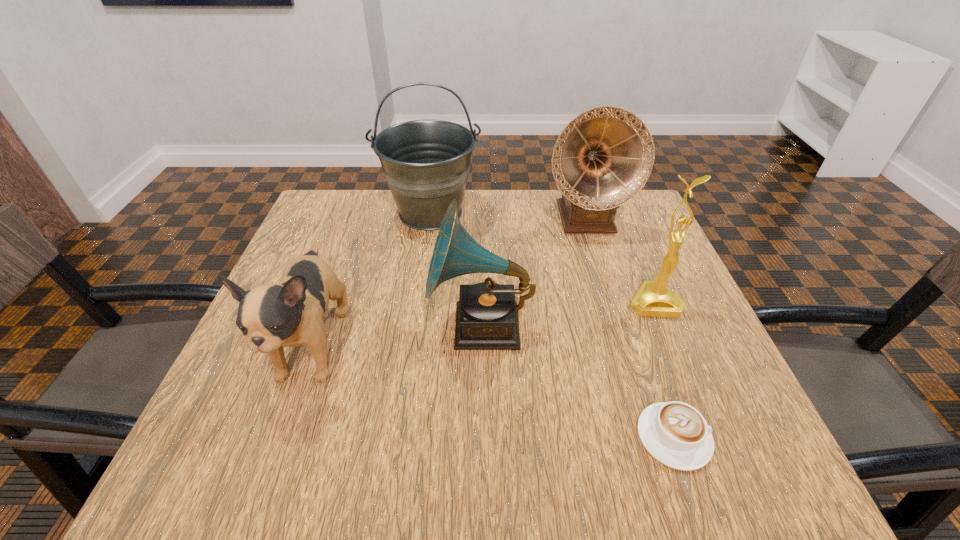
This screenshot has width=960, height=540. Find the location of `bucket`. bucket is located at coordinates (426, 163).

The image size is (960, 540). Find the location of `the farther phonograph_record`. the farther phonograph_record is located at coordinates (603, 157).

You are a GUI agent. You are given a task and a screenshot of the screen. Output one action in this format:
    pyautogui.click(x=<x>, y=<y>)
    Task: Click on the award
    This screenshot has height=540, width=960.
    Given the screenshot: What is the action you would take?
    (653, 299)

Where is `the nearer phonograph_record`? This screenshot has height=540, width=960. the nearer phonograph_record is located at coordinates (486, 314).

Where is `puppy`? Image resolution: width=960 pixels, height=540 pixels. puppy is located at coordinates (272, 316).

The width and height of the screenshot is (960, 540). I want to click on the shortest object, so (676, 434).

Image resolution: width=960 pixels, height=540 pixels. What are the coordinates of `vacant point located on the left of the bucket` in the screenshot? It's located at (354, 213).

Locate an element on the screen. The height and width of the screenshot is (540, 960). free space located 0.300m on the horn of the farther phonograph_record is located at coordinates (620, 335).

This screenshot has height=540, width=960. What are the coordinates of `free region located 0.120m on the front-facing side of the award` in the screenshot? It's located at (681, 367).

Where is `free space located from the horn of the left phonograph_record`? This screenshot has height=540, width=960. free space located from the horn of the left phonograph_record is located at coordinates (331, 326).